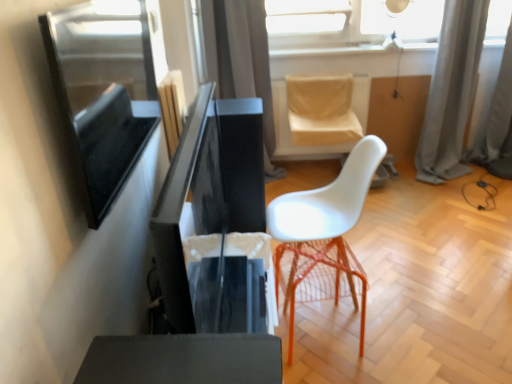
Where is `free region under transparent glass lampshade at upper center (from a real-world perspective)`? Image resolution: width=512 pixels, height=384 pixels. free region under transparent glass lampshade at upper center (from a real-world perspective) is located at coordinates (387, 49).